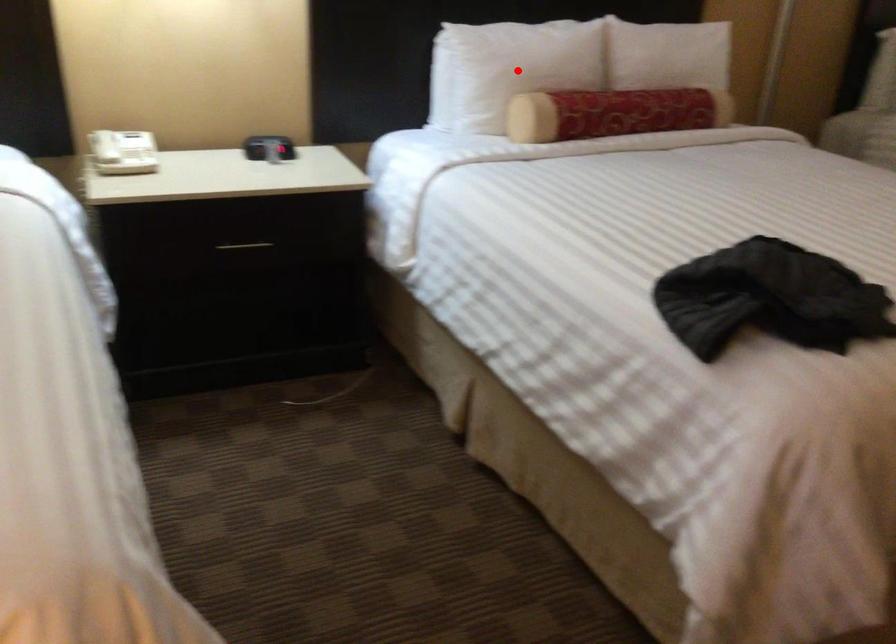
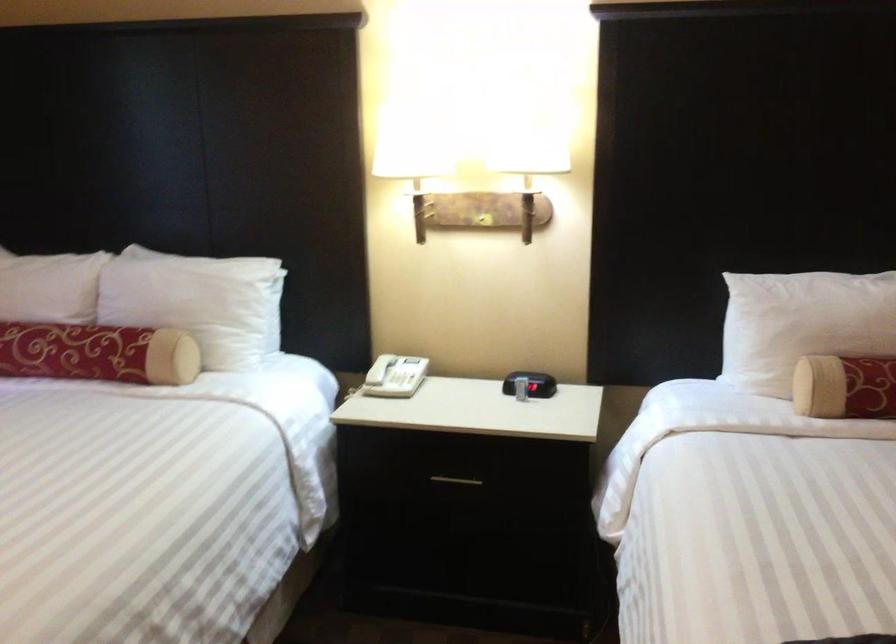
Question: I am providing you with two images of the same scene from different viewpoints. Image1 has a red point marked. In image2, the corresponding 3D location appears at what relative position? Reply with the corresponding letter.

Choices:
 (A) Closer
 (B) Farther

Answer: (A)